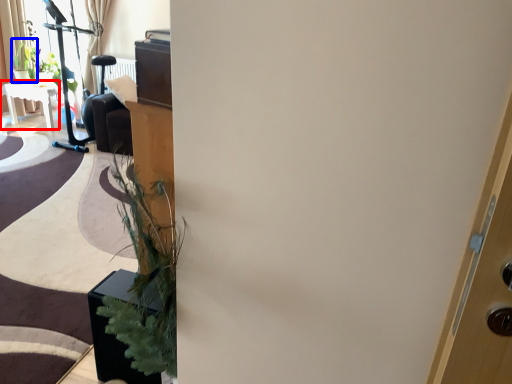
Question: Which object appears farthest to the camera in this image, table (highlighted by a red box) or plant (highlighted by a blue box)?

Choices:
 (A) table
 (B) plant

Answer: (B)